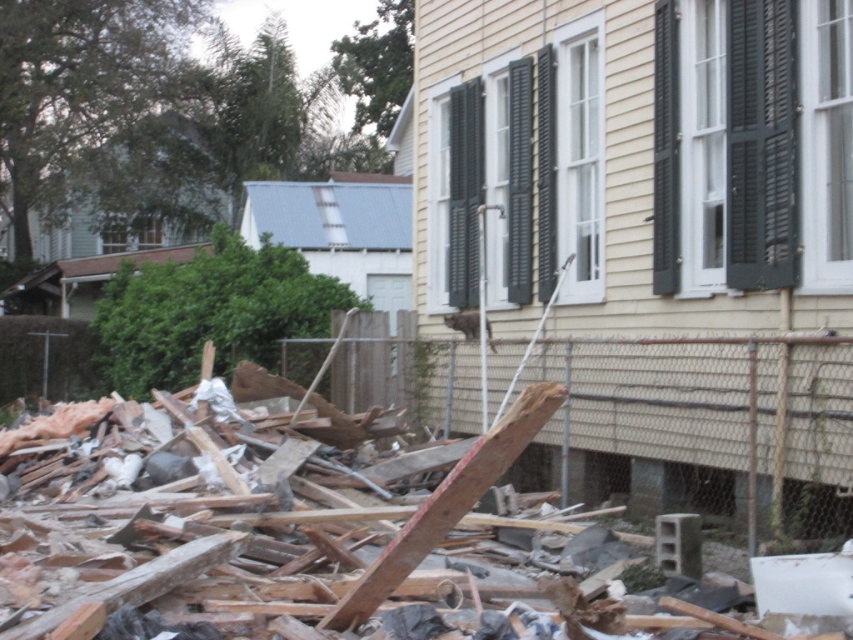
From the picture: You are an architect inspecting the house. You notice two black matte shutters at upper right and black matte shutters at upper center. Which one is shorter in height?

The black matte shutters at upper right are shorter in height compared to the black matte shutters at upper center.

You are standing at the point closest to the house. Which point, point (701, 452) or point (729, 131), is farther away from you?

Point (701, 452) is farther away because it is behind point (729, 131), which is closer to you.